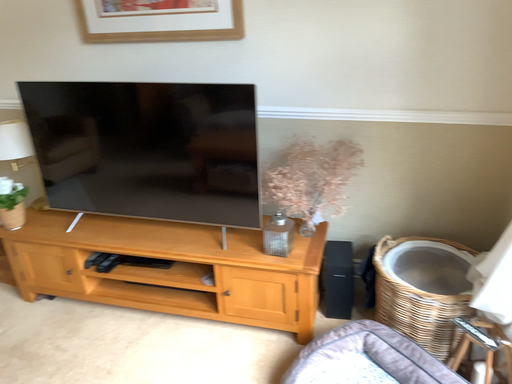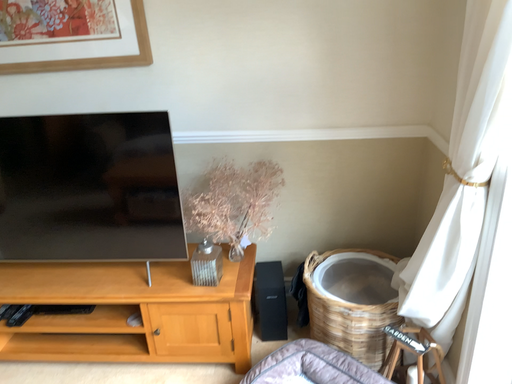
Question: Which way did the camera rotate in the video?

Choices:
 (A) rotated left
 (B) rotated right

Answer: (B)